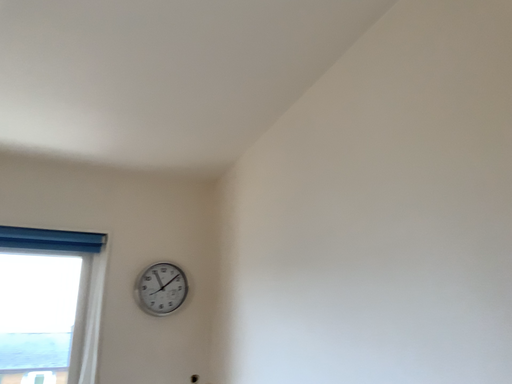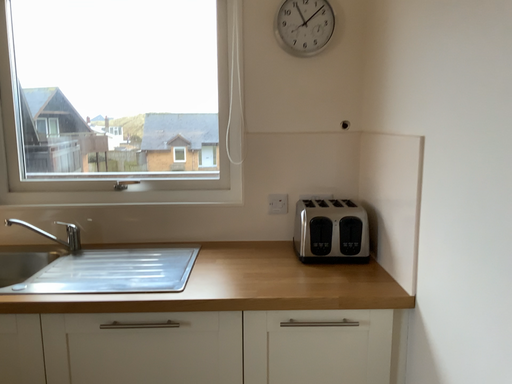
Question: How did the camera likely rotate when shooting the video?

Choices:
 (A) rotated downward
 (B) rotated upward

Answer: (A)